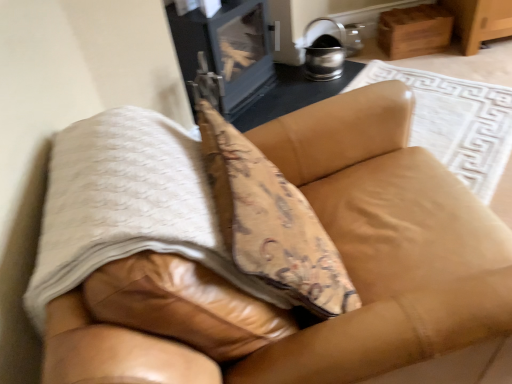
What do you see at coordinates (226, 52) in the screenshot? I see `metallic silver stove at upper center` at bounding box center [226, 52].

This screenshot has width=512, height=384. Identify the location of white textured blanket at center. (127, 205).

Image resolution: width=512 pixels, height=384 pixels. Identify the location of metallic silver stove at upper center. [226, 52].

From a real-world perspective, is leather couch at center on white textured blanket at center?

No, from a real-world perspective, leather couch at center is not over white textured blanket at center

Considering the sizes of objects leather couch at center and white textured blanket at center in the image provided, who is shorter, leather couch at center or white textured blanket at center?

white textured blanket at center.

In terms of size, does leather couch at center appear bigger or smaller than white textured blanket at center?

Clearly, leather couch at center is larger in size than white textured blanket at center.

Is leather couch at center oriented towards white textured blanket at center?

No, leather couch at center does not turn towards white textured blanket at center.

From a real-world perspective, which is physically above, white textured blanket at center or metallic silver stove at upper center?

white textured blanket at center, from a real-world perspective.

Considering the sizes of white textured blanket at center and metallic silver stove at upper center in the image, is white textured blanket at center taller or shorter than metallic silver stove at upper center?

In the image, white textured blanket at center appears to be shorter than metallic silver stove at upper center.

Which object is closer to the camera, white textured blanket at center or metallic silver stove at upper center?

white textured blanket at center.

Considering the sizes of objects white textured blanket at center and metallic silver stove at upper center in the image provided, who is wider, white textured blanket at center or metallic silver stove at upper center?

With larger width is white textured blanket at center.

Looking at this image, can you confirm if leather couch at center is wider than metallic silver stove at upper center?

Yes.

From the image's perspective, is leather couch at center under metallic silver stove at upper center?

Yes, from the image's perspective, leather couch at center is beneath metallic silver stove at upper center.

You are a GUI agent. You are given a task and a screenshot of the screen. Output one action in this format:
    pyautogui.click(x=<x>, y=<y>)
    Task: Click on the furniture in front of the metallic silver stove at upper center
    The height and width of the screenshot is (384, 512).
    Given the screenshot: What is the action you would take?
    pyautogui.click(x=341, y=257)

Is metallic silver stove at upper center taller or shorter than leather couch at center?

Clearly, metallic silver stove at upper center is shorter compared to leather couch at center.

Considering the points (256, 9) and (384, 164), which point is behind, point (256, 9) or point (384, 164)?

Positioned behind is point (256, 9).

Is metallic silver stove at upper center bigger than leather couch at center?

Actually, metallic silver stove at upper center might be smaller than leather couch at center.

Locate an element on the screen. Image resolution: width=512 pixels, height=384 pixels. furniture in front of the metallic silver stove at upper center is located at coordinates (341, 257).

How many degrees apart are the facing directions of white textured blanket at center and leather couch at center?

white textured blanket at center and leather couch at center are facing 5.81 degrees away from each other.

Is white textured blanket at center inside or outside of leather couch at center?

The correct answer is: inside.

Considering the sizes of objects white textured blanket at center and leather couch at center in the image provided, who is wider, white textured blanket at center or leather couch at center?

leather couch at center.

Which is further, (268, 291) or (103, 293)?

The point (268, 291) is more distant.

What are the coordinates of `blanket to the left of metallic silver stove at upper center` in the screenshot? It's located at (127, 205).

Is metallic silver stove at upper center aimed at white textured blanket at center?

No, metallic silver stove at upper center is not oriented towards white textured blanket at center.

Is there a large distance between metallic silver stove at upper center and white textured blanket at center?

metallic silver stove at upper center is far away from white textured blanket at center.

Is point (222, 11) farther from viewer compared to point (61, 141)?

Yes, point (222, 11) is behind point (61, 141).

Locate an element on the screen. The image size is (512, 384). blanket behind the leather couch at center is located at coordinates (127, 205).

Where is `blanket in front of the metallic silver stove at upper center`? This screenshot has height=384, width=512. blanket in front of the metallic silver stove at upper center is located at coordinates (127, 205).

Considering their positions, is metallic silver stove at upper center positioned further to white textured blanket at center than leather couch at center?

metallic silver stove at upper center is positioned further to the anchor white textured blanket at center.

Estimate the real-world distances between objects in this image. Which object is further from white textured blanket at center, leather couch at center or metallic silver stove at upper center?

The object further to white textured blanket at center is metallic silver stove at upper center.

Based on their spatial positions, is white textured blanket at center or metallic silver stove at upper center closer to leather couch at center?

white textured blanket at center lies closer to leather couch at center than the other object.

Which object lies further to the anchor point leather couch at center, metallic silver stove at upper center or white textured blanket at center?

The object further to leather couch at center is metallic silver stove at upper center.

Looking at the image, which one is located closer to metallic silver stove at upper center, leather couch at center or white textured blanket at center?

leather couch at center is closer to metallic silver stove at upper center.

Looking at the image, which one is located closer to metallic silver stove at upper center, white textured blanket at center or leather couch at center?

leather couch at center is closer to metallic silver stove at upper center.

Image resolution: width=512 pixels, height=384 pixels. In order to click on blanket located between leather couch at center and metallic silver stove at upper center in the depth direction in this screenshot , I will do `click(127, 205)`.